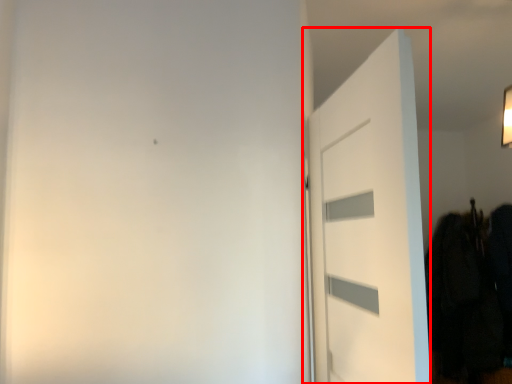
Question: From the image's perspective, considering the relative positions of door (annotated by the red box) and clothing in the image provided, where is door (annotated by the red box) located with respect to the staircase?

Choices:
 (A) below
 (B) above

Answer: (B)